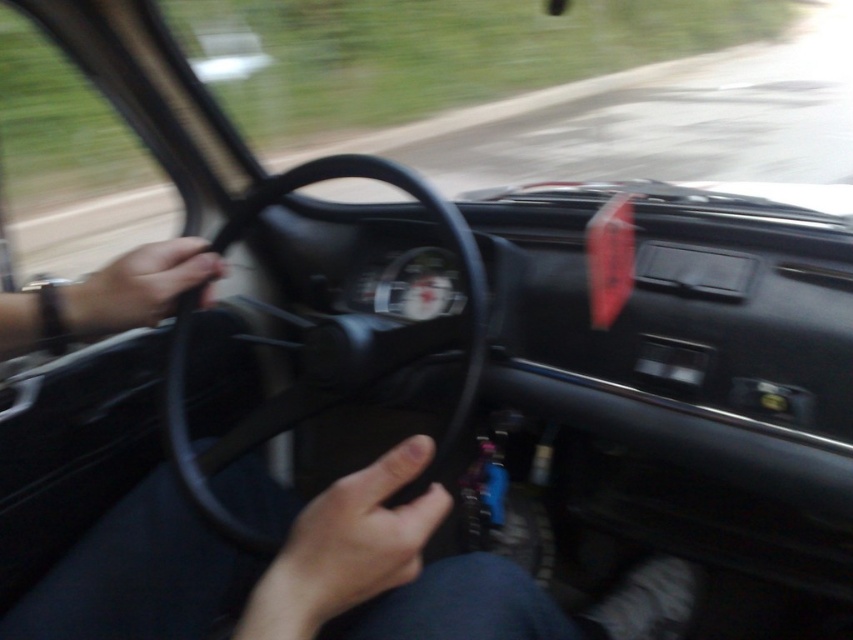
You are a passenger in the car and want to grab the black rubber steering wheel at center. Can you reach it from your seat?

The black rubber steering wheel at center is 25.75 inches from viewer, so yes, you can reach it from your seat since it is within a typical passenger reach distance.

You are a passenger in the car and want to grab the skinny flesh at center and the matte black steering wheel at left. Which object is easier to reach from your current position?

The skinny flesh at center is easier to reach because it has a smaller size compared to the matte black steering wheel at left.